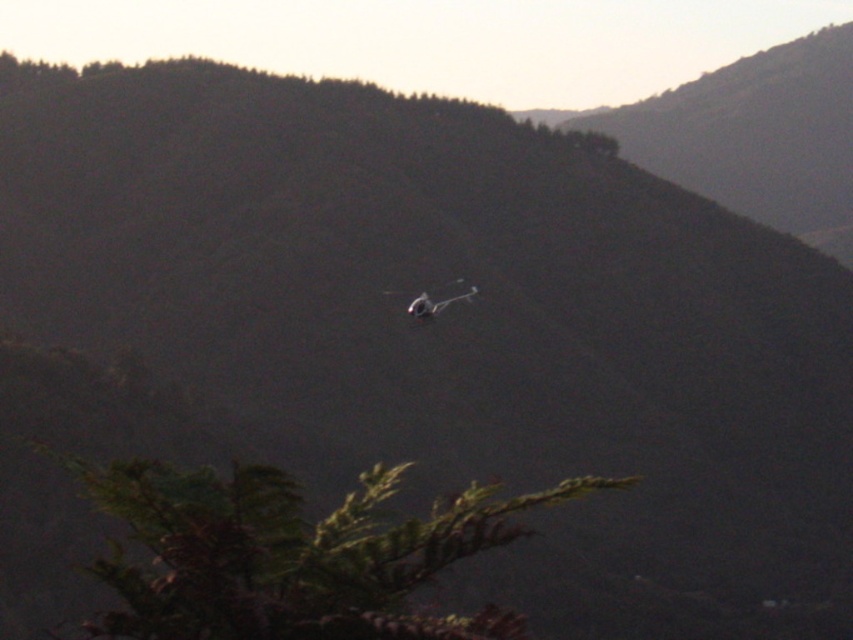
Consider the image. You are a photographer trying to capture the metallic gray plane at center in your shot. You notice the green leafy tree at lower center might block the view. Based on their sizes, will the tree block the plane?

The green leafy tree at lower center has a lesser height compared to metallic gray plane at center, so the tree is shorter than the plane. Therefore, the tree will not block the view of the plane.

You are a photographer trying to capture the metallic gray plane at center and the green leafy tree at lower center in the same frame. Based on their positions, which object should you adjust your camera to focus on first to ensure both are in the frame?

The metallic gray plane at center is at the center of the frame, so you should focus on it first to ensure both the metallic gray plane at center and the green leafy tree at lower center are in the frame.